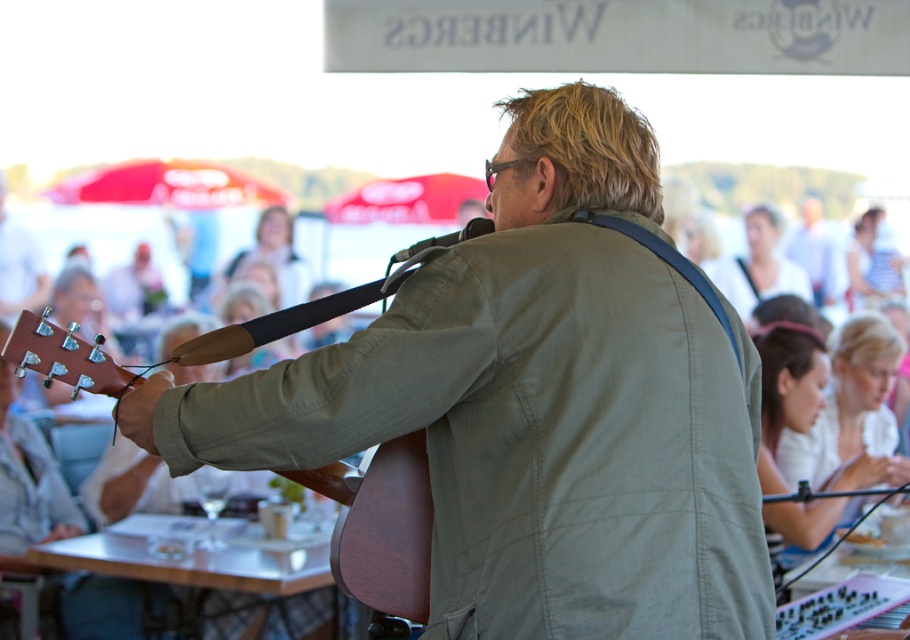
Does matte brown guitar at center have a larger size compared to wooden acoustic guitar at center?

Yes, matte brown guitar at center is bigger than wooden acoustic guitar at center.

Does matte brown guitar at center come in front of wooden acoustic guitar at center?

Yes, it is in front of wooden acoustic guitar at center.

Identify the location of matte brown guitar at center. (534, 404).